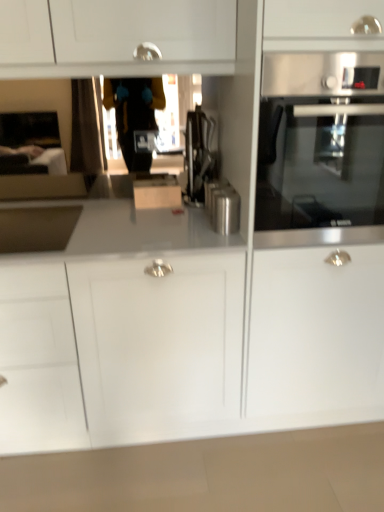
Question: Is the depth of satin black coffee machine at center less than that of satin nickel sink at left?

Choices:
 (A) no
 (B) yes

Answer: (A)

Question: Is satin nickel sink at left located within satin black coffee machine at center?

Choices:
 (A) yes
 (B) no

Answer: (B)

Question: Can you confirm if satin black coffee machine at center is thinner than satin nickel sink at left?

Choices:
 (A) no
 (B) yes

Answer: (B)

Question: From the image's perspective, does satin black coffee machine at center appear lower than satin nickel sink at left?

Choices:
 (A) no
 (B) yes

Answer: (A)

Question: Is satin black coffee machine at center far away from satin nickel sink at left?

Choices:
 (A) no
 (B) yes

Answer: (A)

Question: From a real-world perspective, is satin black coffee machine at center over satin nickel sink at left?

Choices:
 (A) yes
 (B) no

Answer: (A)

Question: Could you tell me if stainless steel oven at right is facing satin metallic canister at center?

Choices:
 (A) yes
 (B) no

Answer: (B)

Question: Is stainless steel oven at right behind satin metallic canister at center?

Choices:
 (A) yes
 (B) no

Answer: (B)

Question: Does stainless steel oven at right appear on the right side of satin metallic canister at center?

Choices:
 (A) yes
 (B) no

Answer: (A)

Question: Can you confirm if stainless steel oven at right is wider than satin metallic canister at center?

Choices:
 (A) no
 (B) yes

Answer: (B)

Question: Is stainless steel oven at right in contact with satin metallic canister at center?

Choices:
 (A) no
 (B) yes

Answer: (A)

Question: From a real-world perspective, is stainless steel oven at right physically below satin metallic canister at center?

Choices:
 (A) yes
 (B) no

Answer: (B)

Question: Is the depth of satin nickel sink at left greater than that of satin metallic canister at center?

Choices:
 (A) yes
 (B) no

Answer: (B)